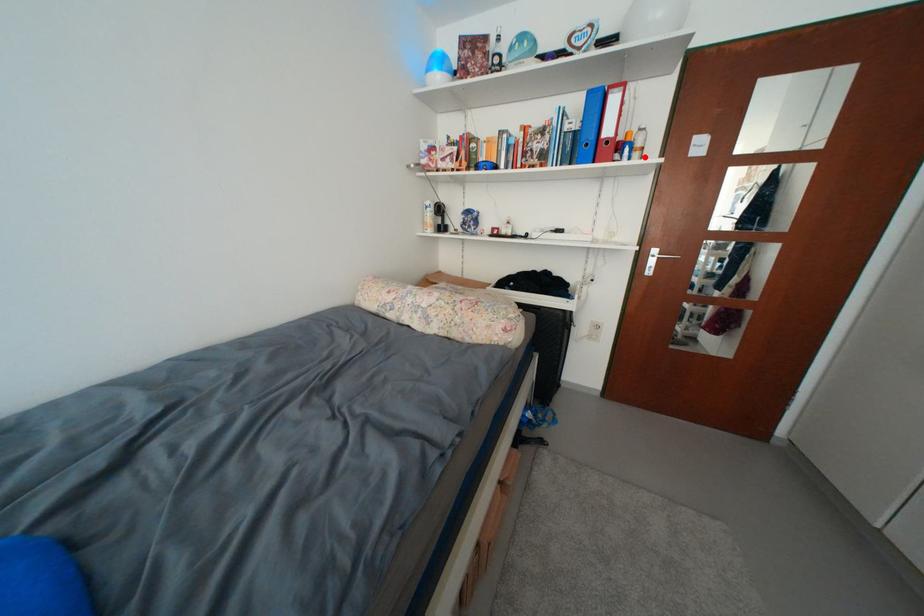
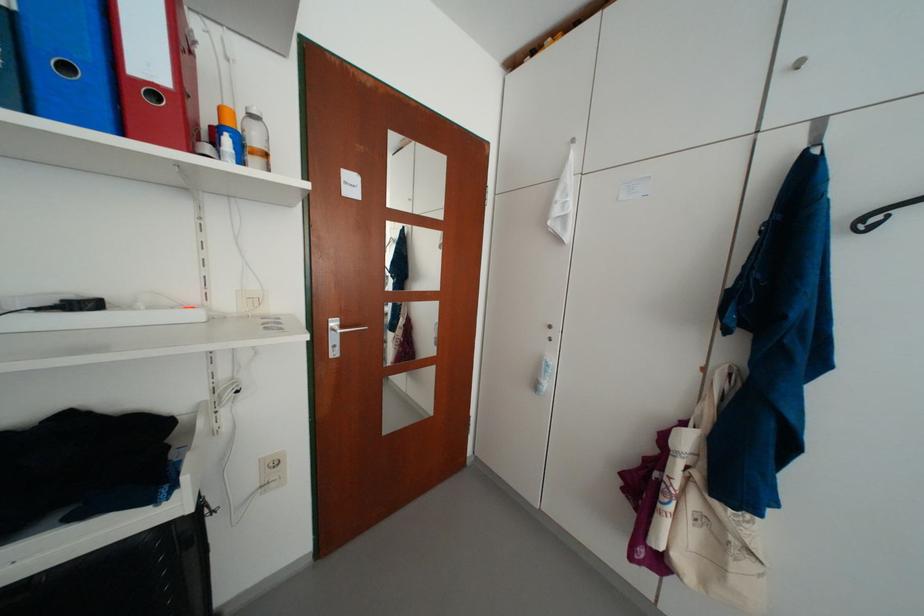
Find the pixel in the second image that matches the highlighted location in the first image.

(263, 163)